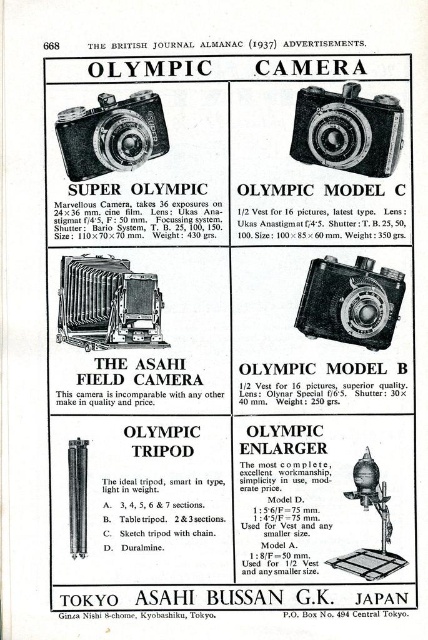
Looking at this image, measure the distance from matte black field camera at center to metallic silver enlarger at lower right.

The distance of matte black field camera at center from metallic silver enlarger at lower right is 17.45 inches.

Where is `matte black field camera at center`? This screenshot has height=640, width=428. matte black field camera at center is located at coordinates (107, 305).

Who is higher up, matte black camera at center or metallic silver enlarger at lower right?

matte black camera at center is above.

Who is more distant from viewer, [330,317] or [385,500]?

The point [330,317] is behind.

The width and height of the screenshot is (428, 640). What do you see at coordinates (350, 301) in the screenshot? I see `matte black camera at center` at bounding box center [350, 301].

I want to click on matte black camera at center, so click(350, 301).

Can you confirm if matte black field camera at center is taller than matte black camera at upper left?

Yes.

Who is more distant from viewer, (151, 275) or (118, 164)?

Point (151, 275)

Who is more distant from viewer, (127,266) or (113,97)?

The point (127,266) is more distant.

At what (x,y) coordinates should I click in order to perform the action: click on matte black field camera at center. Please return your answer as a coordinate pair (x, y). Looking at the image, I should click on (107, 305).